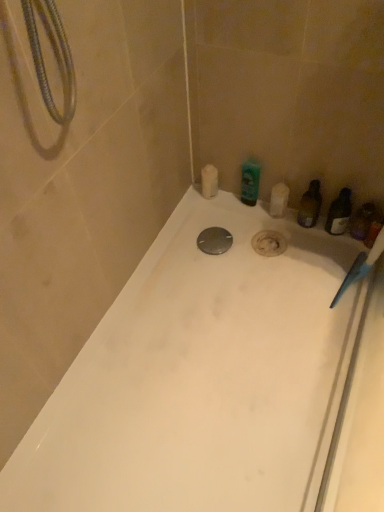
You are a GUI agent. You are given a task and a screenshot of the screen. Output one action in this format:
    pyautogui.click(x=<x>, y=<y>)
    Task: Click on the vacant area to the right of white matte soap bar at upper center, the fourth toiletry positioned from the right
    The width and height of the screenshot is (384, 512).
    Given the screenshot: What is the action you would take?
    pyautogui.click(x=246, y=210)